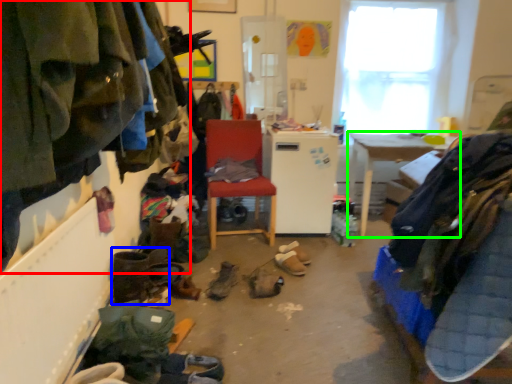
Question: Considering the real-world distances, which object is farthest from clothing (highlighted by a red box)? footwear (highlighted by a blue box) or table (highlighted by a green box)?

Choices:
 (A) footwear
 (B) table

Answer: (B)